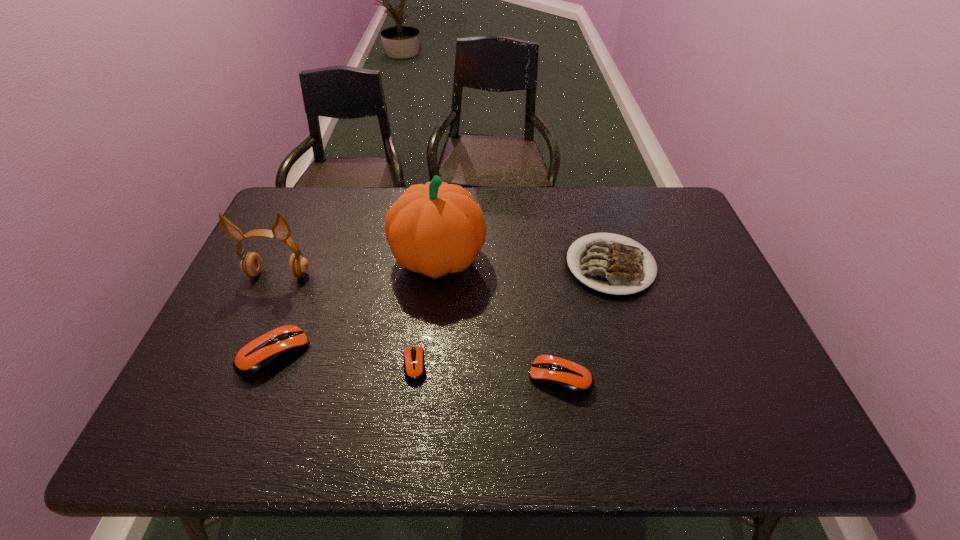
Image resolution: width=960 pixels, height=540 pixels. What are the coordinates of `the leftmost computer mouse` in the screenshot? It's located at (260, 356).

At what (x,y) coordinates should I click in order to perform the action: click on the second computer mouse from left to right. Please return your answer as a coordinate pair (x, y). The width and height of the screenshot is (960, 540). Looking at the image, I should click on (414, 365).

The height and width of the screenshot is (540, 960). What are the coordinates of `the shortest computer mouse` in the screenshot? It's located at (414, 365).

Find the location of a particular element. This screenshot has height=540, width=960. the second shortest computer mouse is located at coordinates (568, 377).

Image resolution: width=960 pixels, height=540 pixels. Identify the location of plate. (607, 266).

At what (x,y) coordinates should I click in order to perform the action: click on the tallest object. Please return your answer as a coordinate pair (x, y). Image resolution: width=960 pixels, height=540 pixels. Looking at the image, I should click on click(x=438, y=228).

The image size is (960, 540). I want to click on earphone, so click(x=251, y=264).

Find the location of a particular element. This screenshot has width=960, height=540. vacant space located on the back of the leftmost computer mouse is located at coordinates (310, 263).

The width and height of the screenshot is (960, 540). In order to click on vacant area situated 0.060m on the left of the shortest object in this screenshot , I will do `click(377, 365)`.

At what (x,y) coordinates should I click in order to perform the action: click on blank space located 0.280m on the right of the second tallest computer mouse. Please return your answer as a coordinate pair (x, y). Looking at the image, I should click on (710, 377).